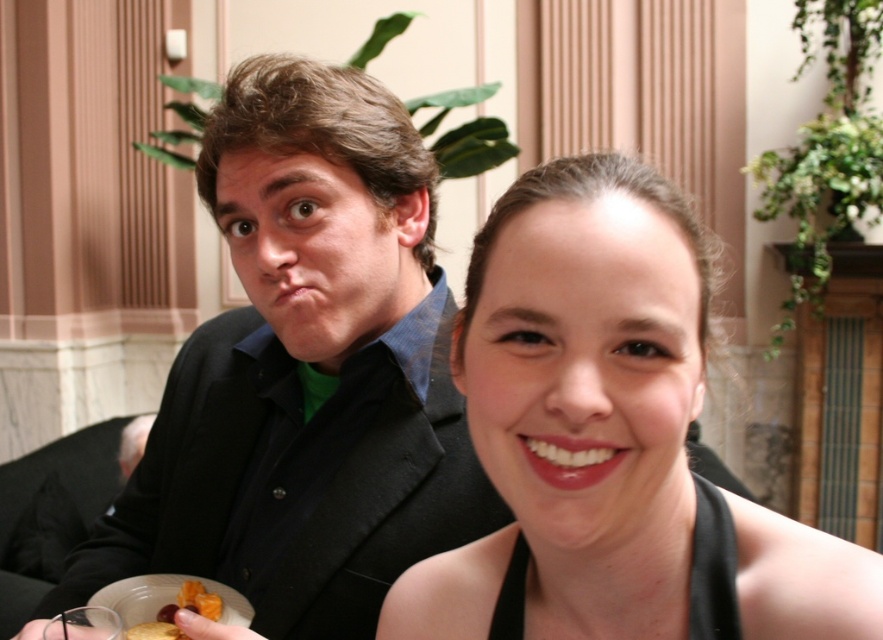
Does black matte suit at center have a greater width compared to orange textured fruit at lower left?

Indeed, black matte suit at center has a greater width compared to orange textured fruit at lower left.

Does black matte suit at center have a smaller size compared to orange textured fruit at lower left?

No.

Who is more forward, (306, 147) or (185, 605)?

Point (306, 147) is in front.

You are a GUI agent. You are given a task and a screenshot of the screen. Output one action in this format:
    pyautogui.click(x=<x>, y=<y>)
    Task: Click on the black matte suit at center
    The image size is (883, 640).
    Given the screenshot: What is the action you would take?
    pyautogui.click(x=306, y=374)

Consider the image. Can you confirm if black matte suit at center is wider than black satin dress at center?

Correct, the width of black matte suit at center exceeds that of black satin dress at center.

Where is `black matte suit at center`? The width and height of the screenshot is (883, 640). black matte suit at center is located at coordinates (306, 374).

Image resolution: width=883 pixels, height=640 pixels. Find the location of `black matte suit at center`. black matte suit at center is located at coordinates (306, 374).

Find the location of `black satin dress at center`. black satin dress at center is located at coordinates (609, 440).

What do you see at coordinates (609, 440) in the screenshot?
I see `black satin dress at center` at bounding box center [609, 440].

Find the location of a particular element. black satin dress at center is located at coordinates (609, 440).